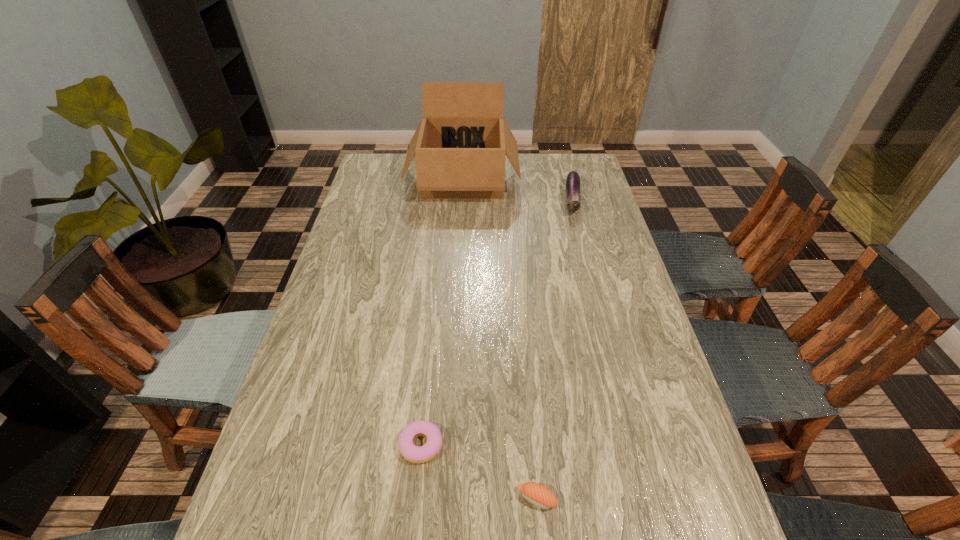
Where is `vacant space positioned 0.400m on the right of the shortest object`? This screenshot has height=540, width=960. vacant space positioned 0.400m on the right of the shortest object is located at coordinates (628, 444).

This screenshot has height=540, width=960. Identify the location of box positioned at the far edge. (460, 144).

What are the coordinates of `eggplant positioned at the far edge` in the screenshot? It's located at (572, 186).

At what (x,y) coordinates should I click in order to perform the action: click on object that is at the right edge. Please return your answer as a coordinate pair (x, y). Looking at the image, I should click on (572, 186).

Identify the location of object that is at the far right corner. This screenshot has height=540, width=960. (572, 186).

In the image, there is a desktop. Find the location of `free space at the far edge`. free space at the far edge is located at coordinates (521, 163).

Image resolution: width=960 pixels, height=540 pixels. In the image, there is a desktop. What are the coordinates of `vacant space at the left edge` in the screenshot? It's located at (329, 332).

Locate an element on the screen. The height and width of the screenshot is (540, 960). free space at the right edge is located at coordinates (718, 529).

Locate an element on the screen. The width and height of the screenshot is (960, 540). vacant space at the far left corner of the desktop is located at coordinates (386, 174).

Find the location of a particular element. This screenshot has height=540, width=960. empty location between the box and the third shortest object is located at coordinates (517, 190).